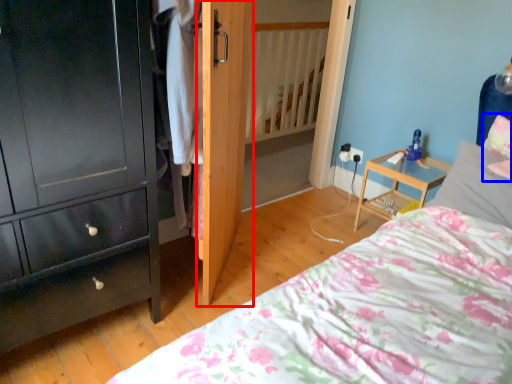
Question: Which point is further to the camera, door (highlighted by a red box) or pillow (highlighted by a blue box)?

Choices:
 (A) door
 (B) pillow

Answer: (B)